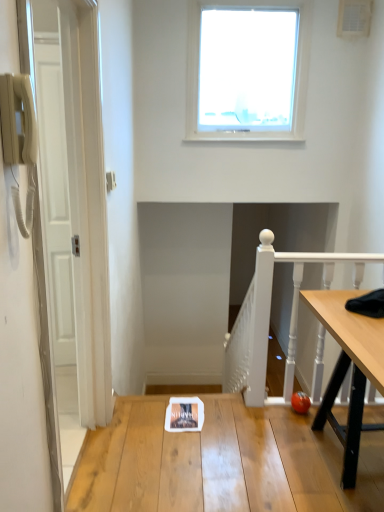
Question: Would you say transparent glass window at upper center is a long distance from white painted wood at right?

Choices:
 (A) no
 (B) yes

Answer: (B)

Question: Does transparent glass window at upper center appear on the right side of white painted wood at right?

Choices:
 (A) no
 (B) yes

Answer: (A)

Question: From a real-world perspective, is transparent glass window at upper center positioned over white painted wood at right based on gravity?

Choices:
 (A) no
 (B) yes

Answer: (B)

Question: Is transparent glass window at upper center positioned behind white painted wood at right?

Choices:
 (A) yes
 (B) no

Answer: (A)

Question: Can you confirm if transparent glass window at upper center is thinner than white painted wood at right?

Choices:
 (A) yes
 (B) no

Answer: (B)

Question: In the image, is wooden table at center positioned in front of or behind transparent glass window at upper center?

Choices:
 (A) behind
 (B) front

Answer: (B)

Question: Do you think wooden table at center is within transparent glass window at upper center, or outside of it?

Choices:
 (A) inside
 (B) outside

Answer: (B)

Question: Is wooden table at center to the left or to the right of transparent glass window at upper center in the image?

Choices:
 (A) right
 (B) left

Answer: (B)

Question: Is wooden table at center taller or shorter than transparent glass window at upper center?

Choices:
 (A) short
 (B) tall

Answer: (A)

Question: Considering the positions of point (286, 4) and point (294, 270), is point (286, 4) closer or farther from the camera than point (294, 270)?

Choices:
 (A) farther
 (B) closer

Answer: (B)

Question: Do you think transparent glass window at upper center is within white painted wood at right, or outside of it?

Choices:
 (A) outside
 (B) inside

Answer: (A)

Question: Considering the positions of transparent glass window at upper center and white painted wood at right in the image, is transparent glass window at upper center taller or shorter than white painted wood at right?

Choices:
 (A) tall
 (B) short

Answer: (A)

Question: Based on their sizes in the image, would you say transparent glass window at upper center is bigger or smaller than white painted wood at right?

Choices:
 (A) small
 (B) big

Answer: (B)

Question: Choose the correct answer: Is wooden table at center inside white painted wood at right or outside it?

Choices:
 (A) outside
 (B) inside

Answer: (A)

Question: Is wooden table at center in front of or behind white painted wood at right in the image?

Choices:
 (A) behind
 (B) front

Answer: (B)